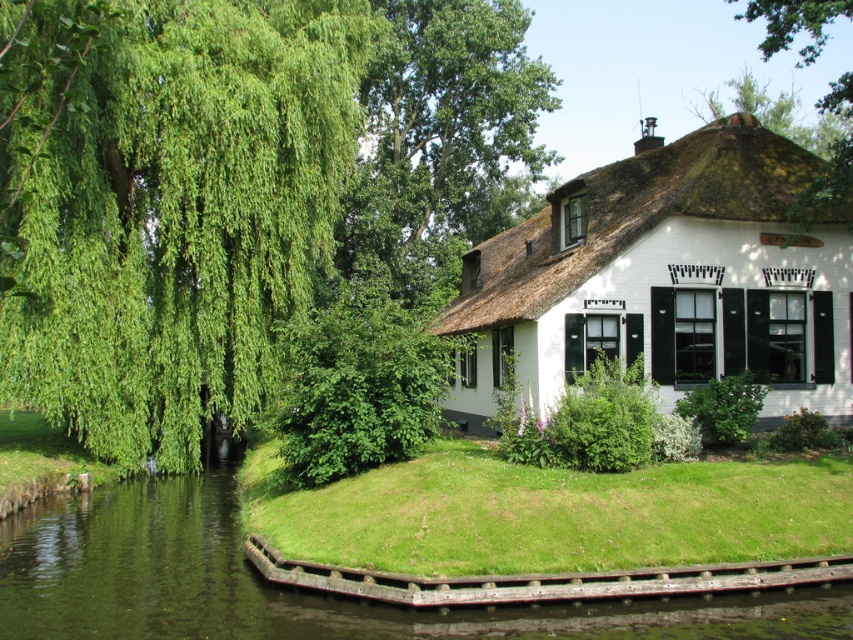
Question: Which point is closer to the camera?

Choices:
 (A) (119, 358)
 (B) (752, 204)
 (C) (30, 509)

Answer: (C)

Question: Based on their relative distances, which object is farther from the green leafy willow at left?

Choices:
 (A) white thatched roof cottage at center
 (B) green grassy river at lower left
 (C) green leafy tree at upper center

Answer: (C)

Question: Can you confirm if white thatched roof cottage at center is positioned to the right of green leafy tree at upper center?

Choices:
 (A) no
 (B) yes

Answer: (A)

Question: Does green leafy willow at left appear on the right side of green grassy river at lower left?

Choices:
 (A) no
 (B) yes

Answer: (A)

Question: Which is farther from the green grassy river at lower left?

Choices:
 (A) green leafy willow at left
 (B) white thatched roof cottage at center

Answer: (B)

Question: Is the position of green leafy willow at left less distant than that of green grassy river at lower left?

Choices:
 (A) yes
 (B) no

Answer: (A)